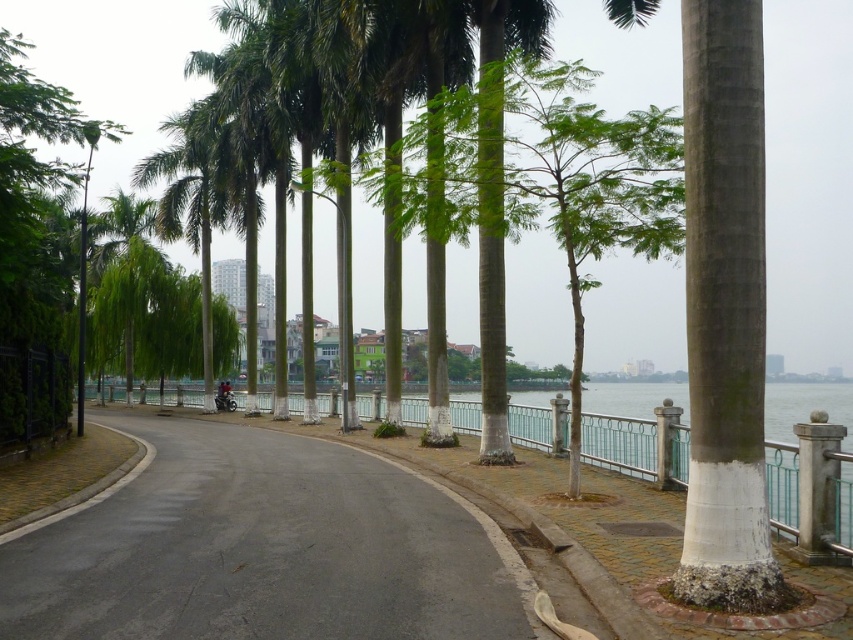
Is black asphalt road at center to the left of white painted concrete pillar at right from the viewer's perspective?

Correct, you'll find black asphalt road at center to the left of white painted concrete pillar at right.

Does black asphalt road at center have a greater width compared to white painted concrete pillar at right?

Yes.

Measure the distance between black asphalt road at center and camera.

black asphalt road at center is 5.81 meters from camera.

Where is `black asphalt road at center`? black asphalt road at center is located at coordinates (262, 548).

This screenshot has width=853, height=640. I want to click on white painted concrete pillar at right, so [724, 310].

Between point (756, 305) and point (804, 465), which one is positioned in front?

Point (756, 305) is in front.

Identify the location of white painted concrete pillar at right. The width and height of the screenshot is (853, 640). (724, 310).

Between black asphalt road at center and white concrete pillar at right, which one appears on the right side from the viewer's perspective?

Positioned to the right is white concrete pillar at right.

Who is taller, black asphalt road at center or white concrete pillar at right?

With more height is white concrete pillar at right.

Which is in front, point (422, 499) or point (822, 477)?

Point (822, 477)

Locate an element on the screen. This screenshot has width=853, height=640. black asphalt road at center is located at coordinates (262, 548).